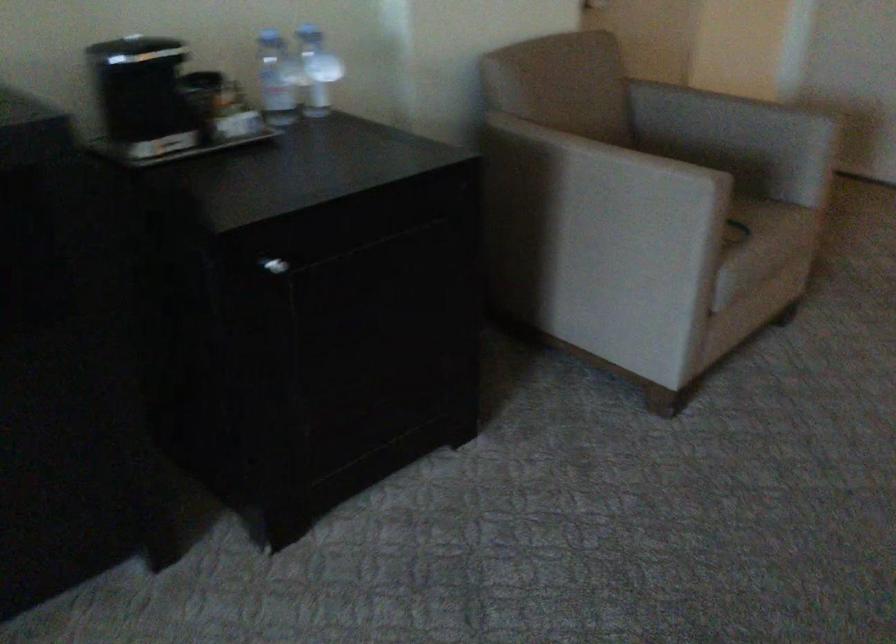
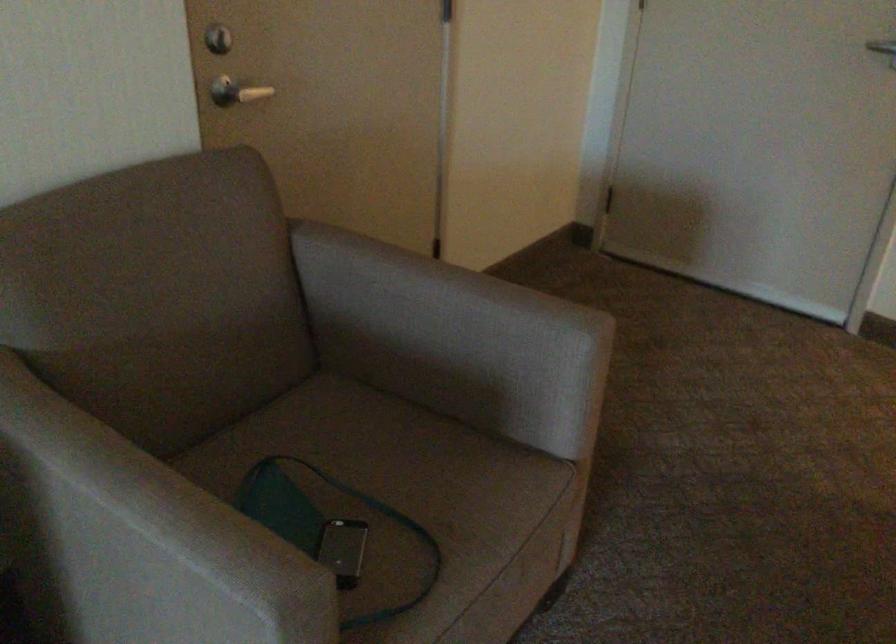
Locate, in the second image, the point that corresponds to (627,166) in the first image.

(150, 538)